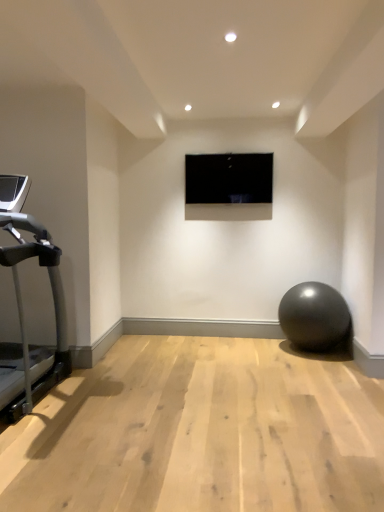
Where is `free space above black glossy screen at center (from a real-world perspective)`? The width and height of the screenshot is (384, 512). free space above black glossy screen at center (from a real-world perspective) is located at coordinates (240, 148).